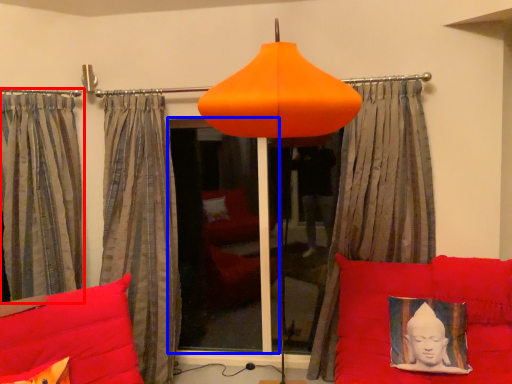
Question: Which of the following is the closest to the observer, curtain (highlighted by a red box) or window screen (highlighted by a blue box)?

Choices:
 (A) curtain
 (B) window screen

Answer: (A)